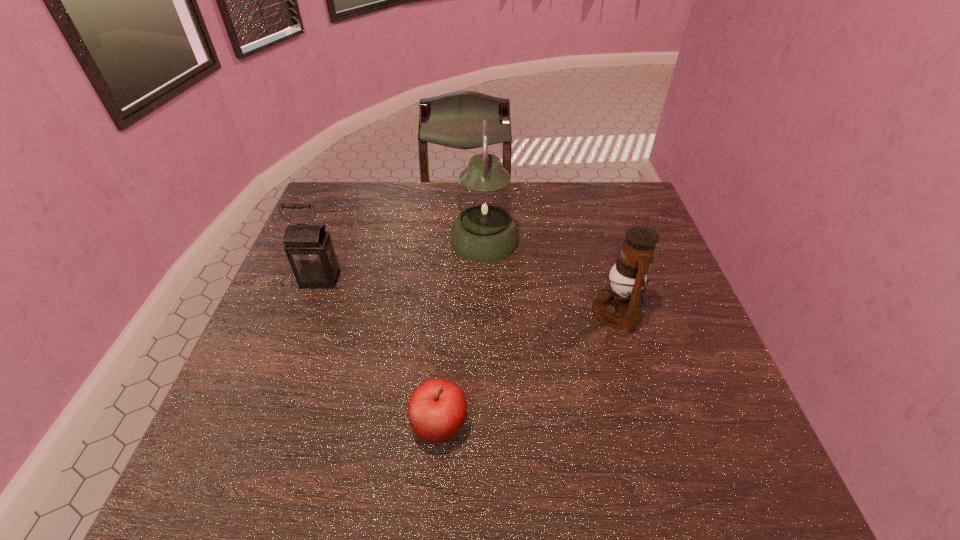
The width and height of the screenshot is (960, 540). Find the location of `free space that satisfies the following two spatial constraints: 1. on the front-facing side of the third tallest object; 2. on the left side of the nearest object`. free space that satisfies the following two spatial constraints: 1. on the front-facing side of the third tallest object; 2. on the left side of the nearest object is located at coordinates (266, 426).